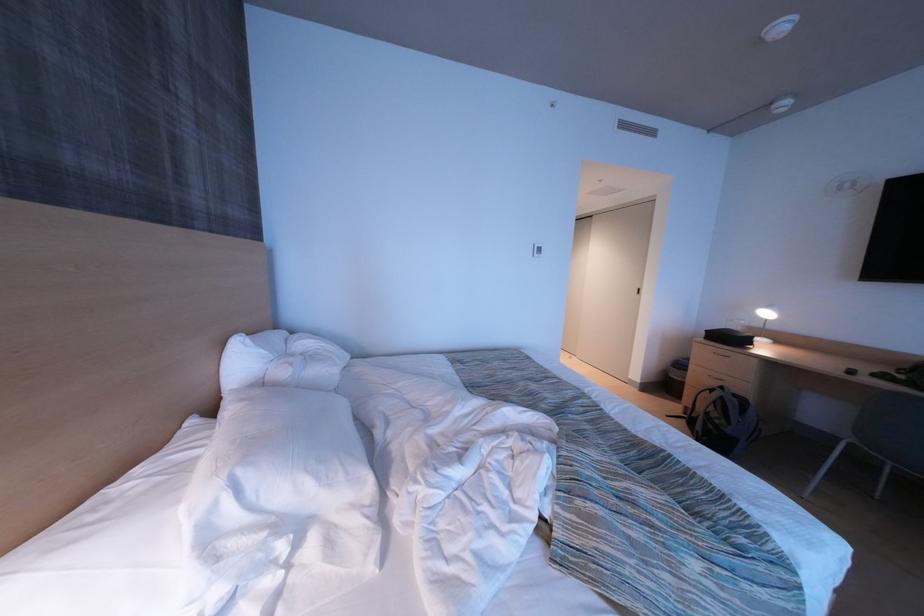
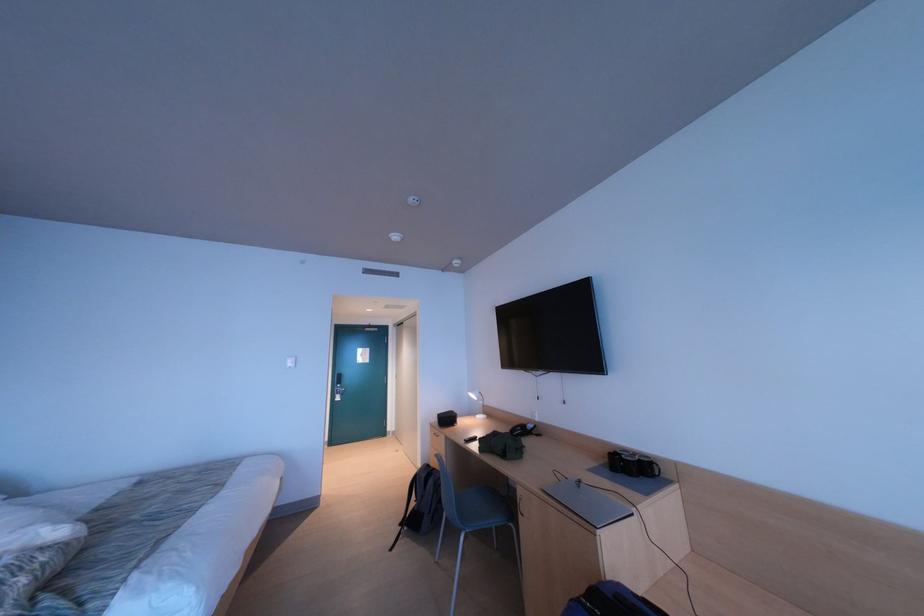
Consider the image. Which direction would the cameraman need to move to produce the second image?

The cameraman moved toward right, backward.